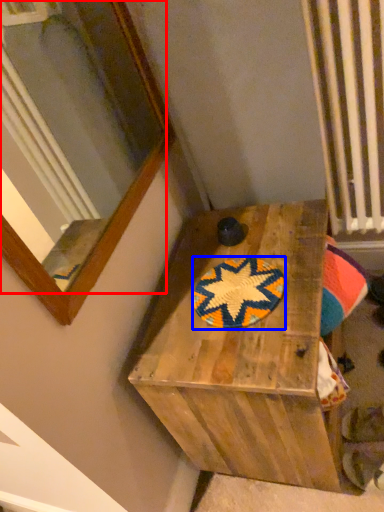
Question: Among these objects, which one is farthest to the camera, mirror (highlighted by a red box) or mat (highlighted by a blue box)?

Choices:
 (A) mirror
 (B) mat

Answer: (B)